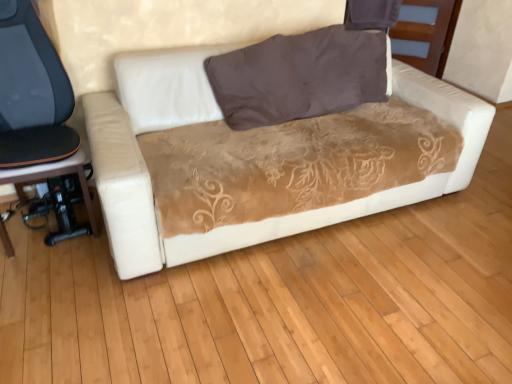
Find the location of `free location in front of black leather chair at left`. free location in front of black leather chair at left is located at coordinates (52, 286).